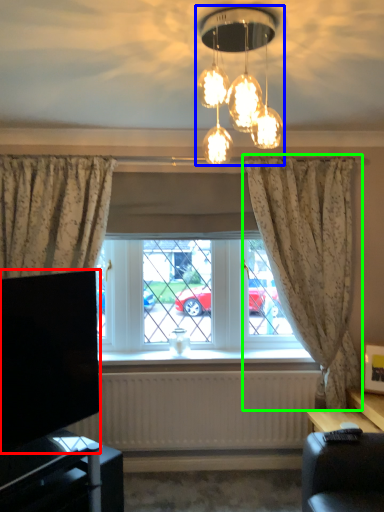
Question: Considering the real-world distances, which object is closest to television (highlighted by a red box)? lamp (highlighted by a blue box) or curtain (highlighted by a green box).

Choices:
 (A) lamp
 (B) curtain

Answer: (A)